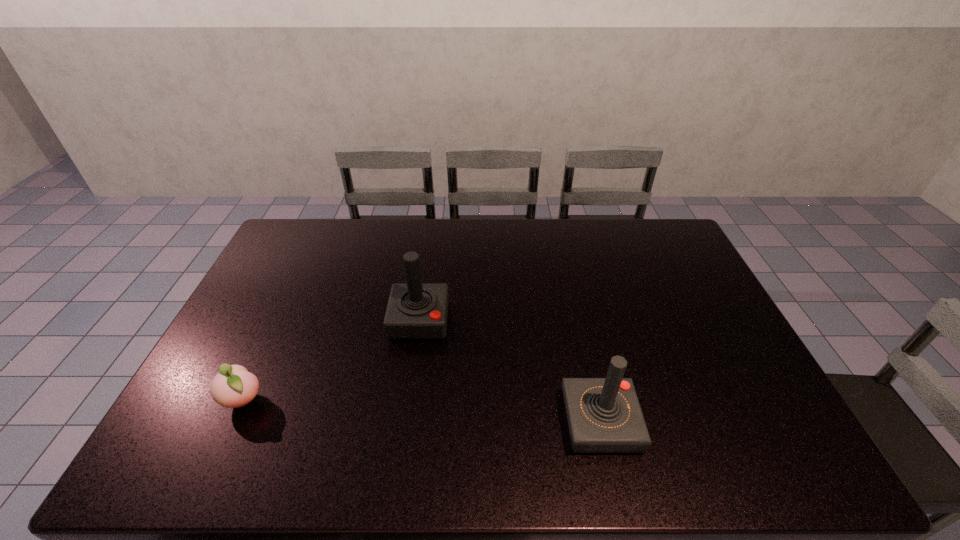
The height and width of the screenshot is (540, 960). What are the coordinates of `free area in between the rightmost object and the leftmost object` in the screenshot? It's located at (422, 411).

At what (x,y) coordinates should I click in order to perform the action: click on free area in between the rightmost object and the leftmost object. Please return your answer as a coordinate pair (x, y). This screenshot has height=540, width=960. Looking at the image, I should click on (422, 411).

Locate an element on the screen. Image resolution: width=960 pixels, height=540 pixels. vacant area that lies between the shortest object and the nearer joystick is located at coordinates (422, 411).

At what (x,y) coordinates should I click in order to perform the action: click on empty space that is in between the leftmost object and the nearer joystick. Please return your answer as a coordinate pair (x, y). Looking at the image, I should click on (422, 411).

Identify the location of free spot between the right joystick and the peach. This screenshot has height=540, width=960. (422, 411).

The image size is (960, 540). What are the coordinates of `vacant space that is in between the leftmost object and the nearer joystick` in the screenshot? It's located at (422, 411).

Where is `vacant space in between the rightmost object and the left joystick`? This screenshot has height=540, width=960. vacant space in between the rightmost object and the left joystick is located at coordinates (510, 372).

Locate an element on the screen. vacant area that lies between the right joystick and the farthest object is located at coordinates (510, 372).

The image size is (960, 540). I want to click on free point between the shortest object and the farthest object, so click(331, 360).

This screenshot has height=540, width=960. Identify the location of the second closest object relative to the farther joystick. (604, 415).